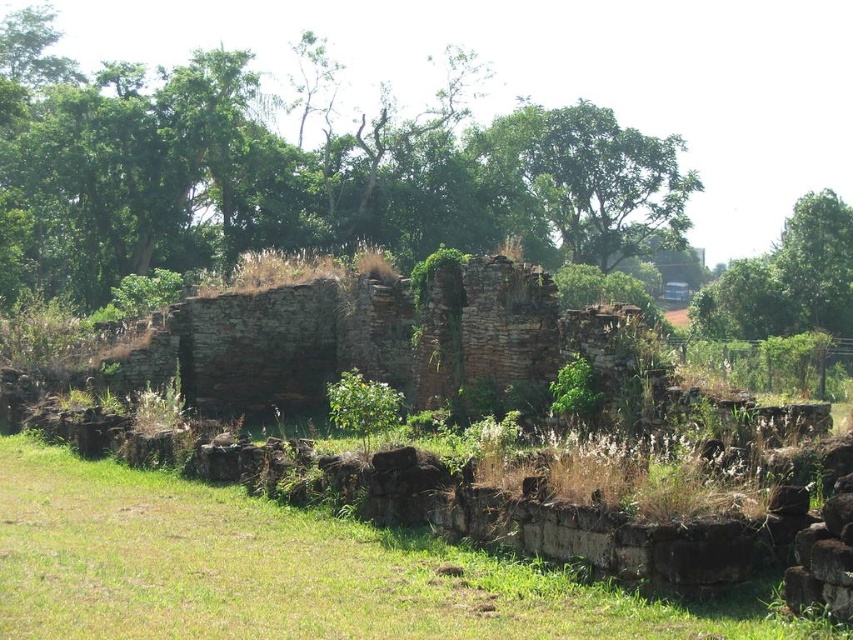
Question: Which of the following is the closest to the observer?

Choices:
 (A) green leafy tree at center
 (B) green grass at lower center
 (C) green leafy tree at upper center

Answer: (B)

Question: Is green leafy tree at center thinner than green leafy tree at upper center?

Choices:
 (A) no
 (B) yes

Answer: (A)

Question: Can you confirm if green leafy tree at center is positioned to the left of green leafy tree at upper center?

Choices:
 (A) no
 (B) yes

Answer: (B)

Question: Among these objects, which one is nearest to the camera?

Choices:
 (A) green grass at lower center
 (B) green leafy tree at upper center
 (C) green leafy tree at center

Answer: (A)

Question: Which of the following is the closest to the observer?

Choices:
 (A) pyautogui.click(x=415, y=577)
 (B) pyautogui.click(x=486, y=182)

Answer: (A)

Question: Does green leafy tree at center lie in front of green grass at lower center?

Choices:
 (A) no
 (B) yes

Answer: (A)